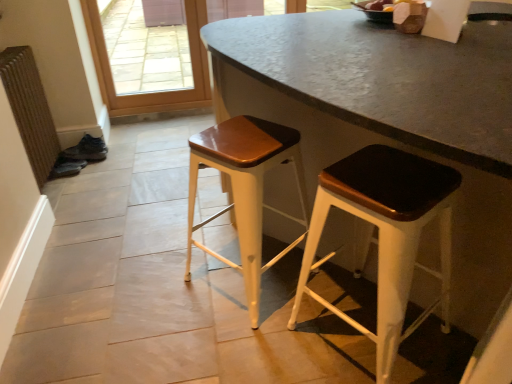
Question: Is wooden seat stool at center, acting as the 2th stool starting from the right, in front of or behind matte black stool at center, which is counted as the first stool, starting from the right, in the image?

Choices:
 (A) behind
 (B) front

Answer: (A)

Question: In the image, is wooden seat stool at center, acting as the 2th stool starting from the right, on the left side or the right side of matte black stool at center, which is counted as the first stool, starting from the right?

Choices:
 (A) right
 (B) left

Answer: (B)

Question: Based on their relative distances, which object is farther from the wooden seat stool at center, the 1th stool when ordered from left to right?

Choices:
 (A) brown textured radiator at left
 (B) matte black stool at center, which is counted as the first stool, starting from the right

Answer: (A)

Question: Estimate the real-world distances between objects in this image. Which object is farther from the brown textured radiator at left?

Choices:
 (A) wooden seat stool at center, the 1th stool when ordered from left to right
 (B) matte black stool at center, the 2th stool positioned from the left

Answer: (B)